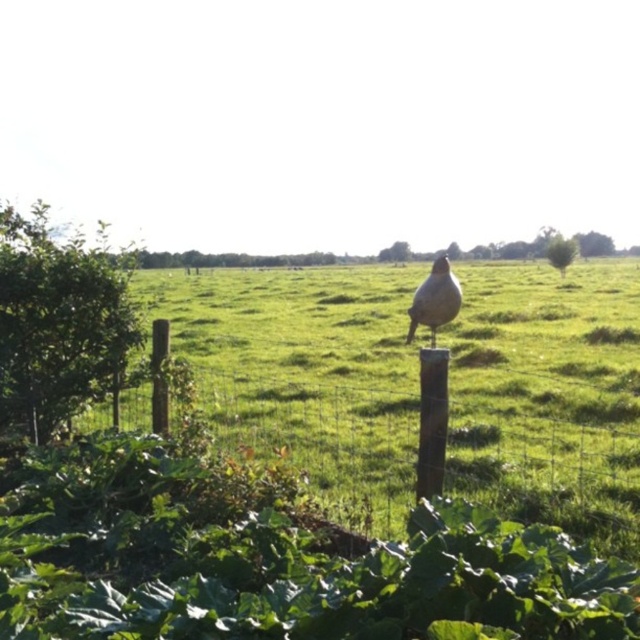
Question: Which of the following is the closest to the observer?

Choices:
 (A) brown speckled bird at center
 (B) brown wooden post at center

Answer: (A)

Question: Is the position of brown wooden post at center less distant than that of brown speckled bird at center?

Choices:
 (A) no
 (B) yes

Answer: (A)

Question: Can you confirm if brown wooden post at center is positioned below brown speckled bird at center?

Choices:
 (A) no
 (B) yes

Answer: (B)

Question: Which object is farther from the camera taking this photo?

Choices:
 (A) brown speckled bird at center
 (B) brown wooden post at center

Answer: (B)

Question: Is brown wooden post at center closer to the viewer compared to brown speckled bird at center?

Choices:
 (A) no
 (B) yes

Answer: (A)